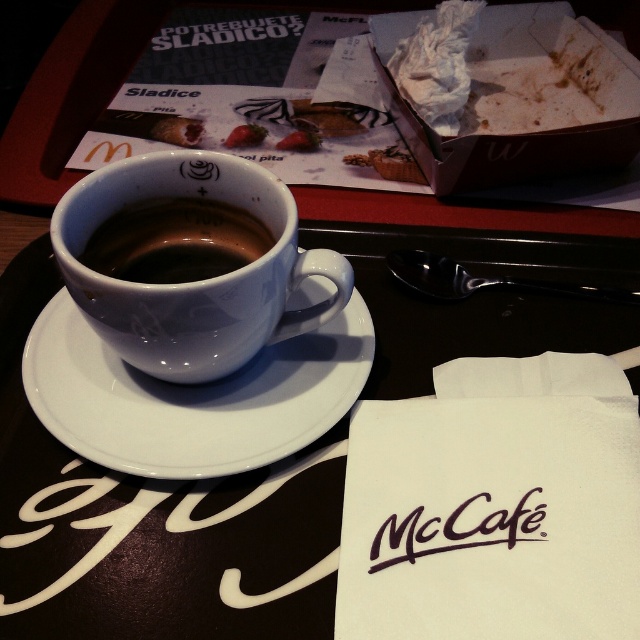
You are at McDonalds and want to place your matte ceramic cup at center on the white ceramic saucer at center. Will the cup fit on the saucer?

The white ceramic saucer at center is larger in size than the matte ceramic cup at center, so the cup will fit on the saucer.

You are a customer at McDonalds and want to place your phone on the tray. The phone is 15 cm long. The tray has a rectangular surface. The matte ceramic cup at center is located at point 0.378, 0.275. Can you place your phone horizontally on the tray without it overlapping with the cup?

The matte ceramic cup at center is located at point (x=176, y=241). Since the phone is 15 cm long and the tray is rectangular, you need to ensure there is enough space on the tray away from the cup to place the phone horizontally. However, without knowing the exact dimensions of the tray and the cup, it is impossible to determine if the phone will fit without overlapping. Please check the tray size and the cup dimensions first.